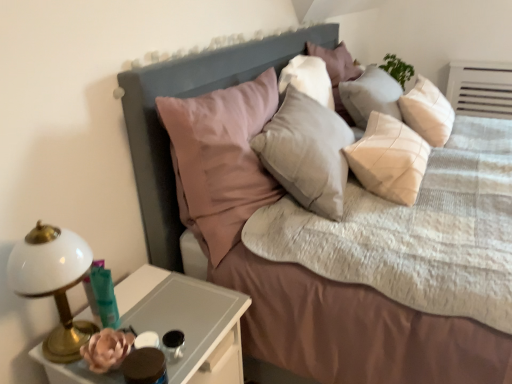
I want to click on blank space above white glossy nightstand at lower left (from a real-world perspective), so click(164, 307).